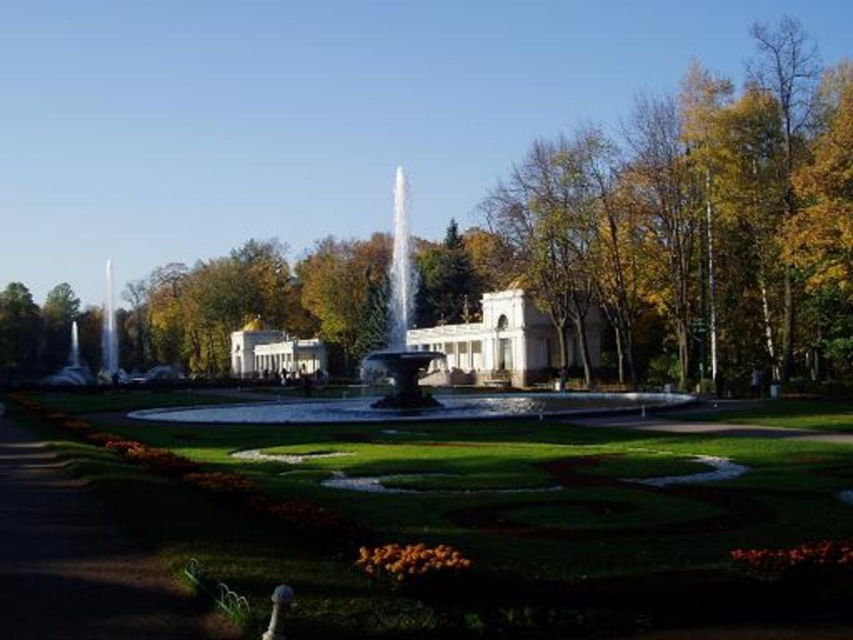
You are a gardener who needs to water the green grass at lower left and the shiny silver fountain at center. Since the water source is located to the right of the fountain, which area should you water first to save time?

The green grass at lower left is positioned on the left side of the shiny silver fountain at center, so you should water the green grass at lower left first before moving to the fountain to minimize backtracking.

You are standing at the center of the park and want to find the green grass at lower left. Based on the coordinates provided, in which direction should you look to see it?

The green grass at lower left is located at coordinates point (78, 561), so you should look towards the lower left direction to see it.